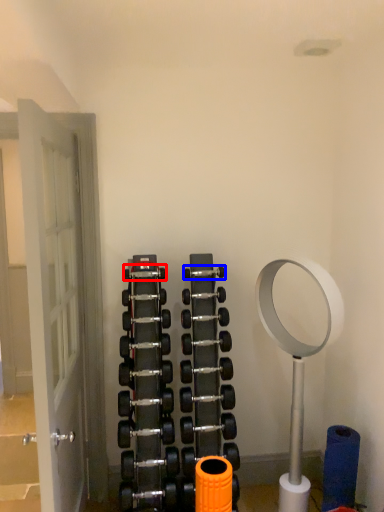
Question: Which object is closer to the camera taking this photo, dumbbell (highlighted by a red box) or dumbbell (highlighted by a blue box)?

Choices:
 (A) dumbbell
 (B) dumbbell

Answer: (A)